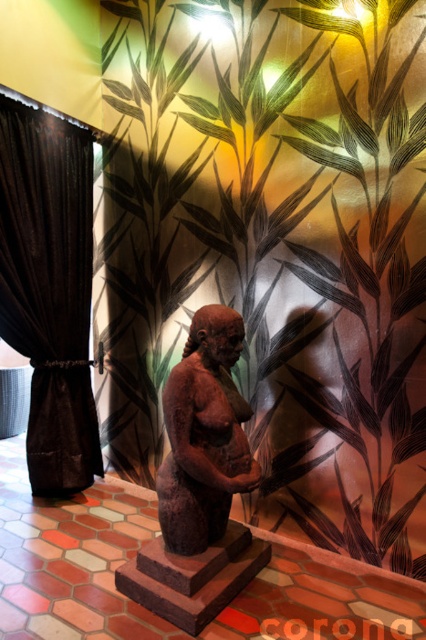
You are an interior designer planning to place a new decorative item between the black velvet curtain at left and the brown clay figurine at center. Which object should you place the item closer to if you want it to be near the wider object?

The black velvet curtain at left is wider than the brown clay figurine at center, so you should place the item closer to the black velvet curtain at left.

You are an interior designer examining the statue and the wall mural in the room. You notice two points marked on the image at coordinates point (310, 166) and point (60, 420). Which of these points is nearer to your viewpoint as you look at the image?

Point (310, 166) is closer to the camera than point (60, 420), so the point at (310, 166) is nearer to your viewpoint.

You are standing in the room and want to take a closer look at the statue. If you walk forward 5 feet, will you be closer to the statue than the point at coordinate (276,529)?

The distance between the point at coordinate (276,529) and the camera is 10.26 feet. If you walk forward 5 feet, you will be 5.26 feet away from the point, which is closer than the original distance. Therefore, yes, you will be closer to the statue than the point at coordinate (276,529) after moving forward 5 feet.